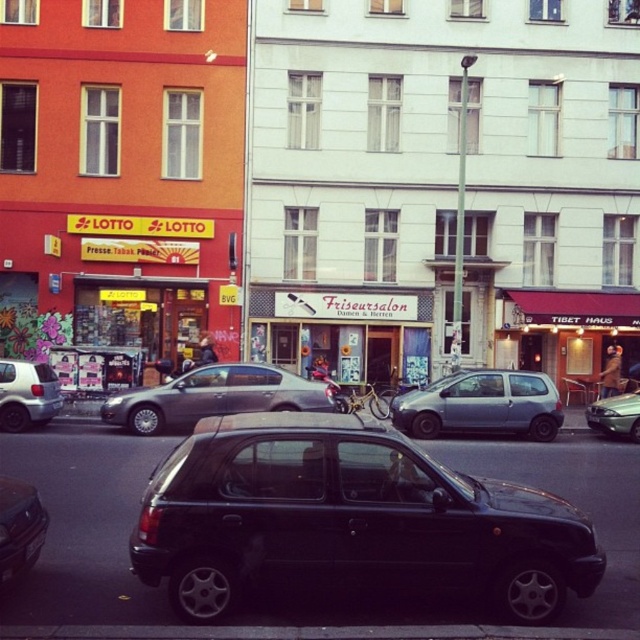
You are a delivery driver who needs to park your van between the black matte car at center and the silver metallic sedan at center. According to the scene, can you fit your van there?

The black matte car at center is above the silver metallic sedan at center, so there is no space between them for the van to park.

You are a delivery driver who needs to park your vehicle next to the LOTTO store. Based on the image, where should you position your car relative to the black matte car at center?

The black matte car at center is located at point [348,520], so you should position your car near that coordinate to park next to the LOTTO store.